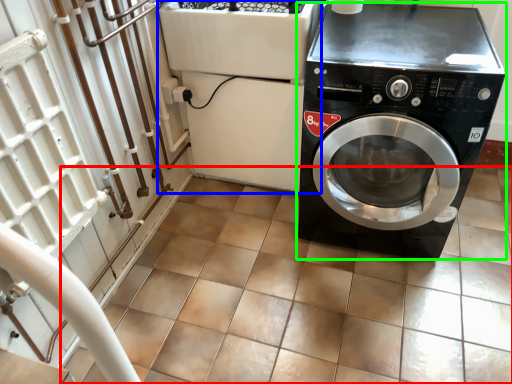
Question: Which object is the closest to the tile (highlighted by a red box)? Choose among these: appliance (highlighted by a blue box) or washing machine (highlighted by a green box).

Choices:
 (A) appliance
 (B) washing machine

Answer: (B)